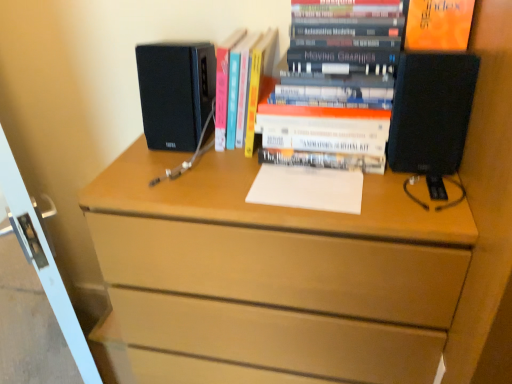
Question: From the image's perspective, is black matte speaker at right, which ranks as the first desktop computer in right-to-left order, above or below white glossy screen door at left?

Choices:
 (A) above
 (B) below

Answer: (A)

Question: Looking at the image, does black matte speaker at right, the 2th desktop computer in the left-to-right sequence, seem bigger or smaller compared to white glossy screen door at left?

Choices:
 (A) big
 (B) small

Answer: (B)

Question: Estimate the real-world distances between objects in this image. Which object is farther from the white paper at center?

Choices:
 (A) orange matte paper at upper right
 (B) hardcover book at center, the 2th book positioned from the right
 (C) black matte speaker at right, which ranks as the first desktop computer in right-to-left order
 (D) black matte speaker at upper left, the first desktop computer positioned from the left
 (E) hardcover books at center, marked as the first book in a right-to-left arrangement

Answer: (A)

Question: Which object is the closest to the white paper at center?

Choices:
 (A) hardcover book at center, which appears as the first book when viewed from the left
 (B) hardcover books at center, which appears as the 2th book when viewed from the left
 (C) black matte speaker at right, the 2th desktop computer in the left-to-right sequence
 (D) black matte speaker at upper left, the first desktop computer positioned from the left
 (E) orange matte paper at upper right

Answer: (B)